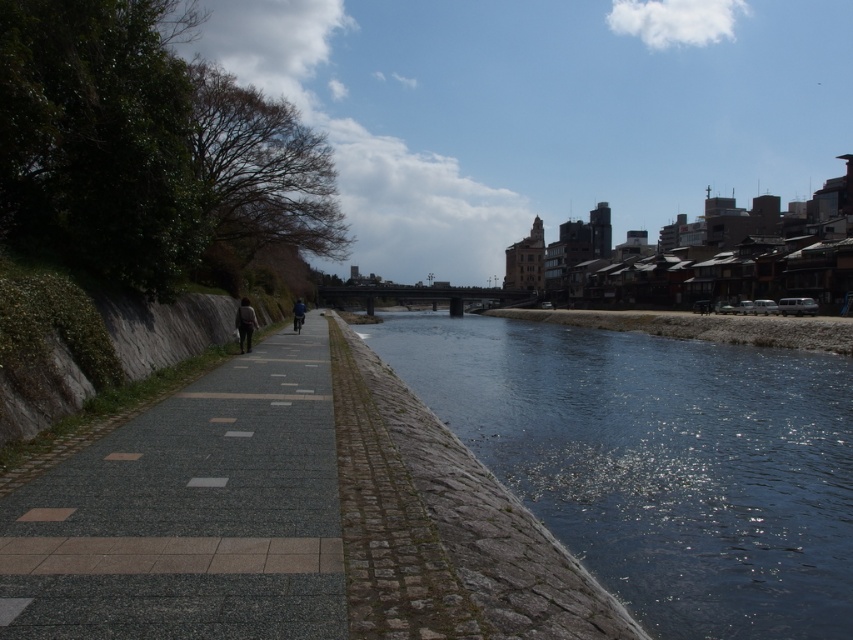
What do you see at coordinates (659, 461) in the screenshot? I see `dark blue water at center` at bounding box center [659, 461].

Does dark blue water at center have a greater width compared to gray cobblestone sidewalk at center?

Yes.

Is point (433, 410) closer to camera compared to point (201, 518)?

No, it is behind (201, 518).

Find the location of a particular element. Image resolution: width=853 pixels, height=640 pixels. dark blue water at center is located at coordinates (659, 461).

Who is taller, dark blue water at center or blue fabric jacket at center?

Standing taller between the two is blue fabric jacket at center.

Where is `dark blue water at center`? dark blue water at center is located at coordinates (659, 461).

Find the location of a particular element. This screenshot has width=853, height=640. dark blue water at center is located at coordinates (659, 461).

The height and width of the screenshot is (640, 853). Find the location of `dark blue water at center`. dark blue water at center is located at coordinates click(x=659, y=461).

Does point (631, 451) lie behind point (248, 320)?

No, (631, 451) is in front of (248, 320).

Does point (433, 316) come closer to viewer compared to point (236, 316)?

No, (433, 316) is further to viewer.

Locate an element on the screen. This screenshot has width=853, height=640. dark blue water at center is located at coordinates 659,461.